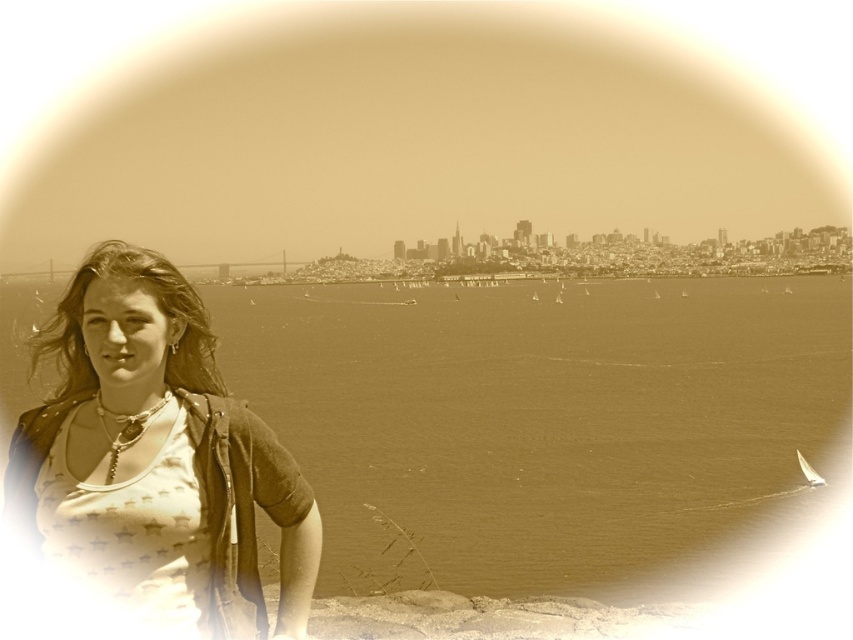
Question: Which of the following is the farthest from the observer?

Choices:
 (A) matte beige tank top at left
 (B) metallic bridge at center
 (C) brown water at center
 (D) white sailboat at lower right

Answer: (D)

Question: Is metallic bridge at center positioned behind white sailboat at lower right?

Choices:
 (A) yes
 (B) no

Answer: (B)

Question: Which object is farther from the camera taking this photo?

Choices:
 (A) white sailboat at lower right
 (B) metallic bridge at center
 (C) matte beige tank top at left
 (D) brown water at center

Answer: (A)

Question: Among these objects, which one is farthest from the camera?

Choices:
 (A) white sailboat at lower right
 (B) matte beige tank top at left
 (C) metallic bridge at center

Answer: (A)

Question: Can you confirm if matte beige tank top at left is thinner than white sailboat at lower right?

Choices:
 (A) no
 (B) yes

Answer: (A)

Question: Is brown water at center wider than matte beige tank top at left?

Choices:
 (A) yes
 (B) no

Answer: (A)